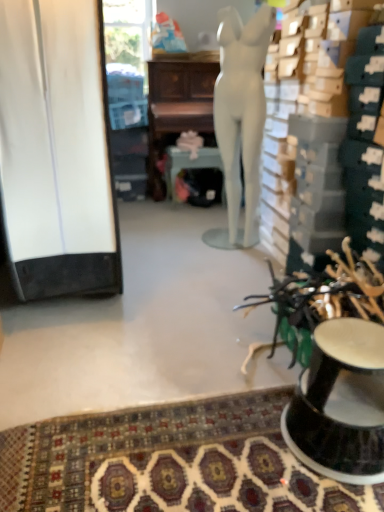
Find the location of a particular element. This screenshot has height=512, width=384. matte silver round table at center is located at coordinates (188, 164).

What do you see at coordinates (178, 105) in the screenshot? I see `wooden desk at center` at bounding box center [178, 105].

Where is `patterned carpet at lower center`? This screenshot has height=512, width=384. patterned carpet at lower center is located at coordinates (169, 462).

In order to click on white matte mannequin at center in this screenshot , I will do `click(241, 118)`.

This screenshot has height=512, width=384. I want to click on black glossy pedestal at lower right, so click(341, 403).

Considering the positions of point (250, 91) and point (169, 160), is point (250, 91) closer or farther from the camera than point (169, 160)?

Point (250, 91) is positioned closer to the camera compared to point (169, 160).

Is white matte mannequin at center shorter than matte silver round table at center?

No, white matte mannequin at center is not shorter than matte silver round table at center.

From the image's perspective, which is above, white matte mannequin at center or matte silver round table at center?

white matte mannequin at center.

Considering the relative sizes of white matte mannequin at center and matte silver round table at center in the image provided, is white matte mannequin at center thinner than matte silver round table at center?

Indeed, white matte mannequin at center has a lesser width compared to matte silver round table at center.

In the scene shown: Is matte silver round table at center to the right of patterned carpet at lower center from the viewer's perspective?

Yes, matte silver round table at center is to the right of patterned carpet at lower center.

From a real-world perspective, who is located higher, matte silver round table at center or patterned carpet at lower center?

From a 3D spatial view, matte silver round table at center is above.

Is matte silver round table at center positioned in front of patterned carpet at lower center?

No, matte silver round table at center is behind patterned carpet at lower center.

From the image's perspective, which one is positioned lower, matte silver round table at center or patterned carpet at lower center?

patterned carpet at lower center, from the image's perspective.

From the image's perspective, who appears lower, matte silver round table at center or wooden desk at center?

From the image's view, matte silver round table at center is below.

Does point (211, 147) lie behind point (148, 114)?

No, (211, 147) is closer to viewer.

Based on their sizes in the image, would you say matte silver round table at center is bigger or smaller than wooden desk at center?

Considering their sizes, matte silver round table at center takes up less space than wooden desk at center.

Which of these two, matte silver round table at center or wooden desk at center, stands shorter?

Standing shorter between the two is matte silver round table at center.

Locate an element on the screen. person above the wooden desk at center (from a real-world perspective) is located at coordinates (241, 118).

In the image, is white matte mannequin at center positioned in front of or behind wooden desk at center?

white matte mannequin at center is positioned closer to the viewer than wooden desk at center.

From a real-world perspective, which is physically above, white matte mannequin at center or wooden desk at center?

white matte mannequin at center.

Is white matte mannequin at center oriented towards wooden desk at center?

No, white matte mannequin at center does not turn towards wooden desk at center.

From the image's perspective, which is below, black glossy pedestal at lower right or patterned carpet at lower center?

patterned carpet at lower center appears lower in the image.

Which object is positioned more to the left, black glossy pedestal at lower right or patterned carpet at lower center?

patterned carpet at lower center is more to the left.

From the picture: Considering the relative sizes of black glossy pedestal at lower right and patterned carpet at lower center in the image provided, is black glossy pedestal at lower right bigger than patterned carpet at lower center?

Correct, black glossy pedestal at lower right is larger in size than patterned carpet at lower center.

I want to click on furniture that is above the patterned carpet at lower center (from a real-world perspective), so click(x=341, y=403).

Identify the location of person above the white matte cabinet at left (from the image's perspective). (241, 118).

In terms of size, does white matte cabinet at left appear bigger or smaller than white matte mannequin at center?

Considering their sizes, white matte cabinet at left takes up more space than white matte mannequin at center.

Between white matte cabinet at left and white matte mannequin at center, which one appears on the right side from the viewer's perspective?

white matte mannequin at center.

Is the position of white matte cabinet at left less distant than that of white matte mannequin at center?

Yes, the depth of white matte cabinet at left is less than that of white matte mannequin at center.

Does patterned carpet at lower center have a larger size compared to matte silver round table at center?

No.

Between patterned carpet at lower center and matte silver round table at center, which one has smaller width?

Thinner between the two is matte silver round table at center.

Is patterned carpet at lower center looking in the opposite direction of matte silver round table at center?

No, patterned carpet at lower center's orientation is not away from matte silver round table at center.

What's the angular difference between patterned carpet at lower center and matte silver round table at center's facing directions?

There is a 178-degree angle between the facing directions of patterned carpet at lower center and matte silver round table at center.

I want to click on person positioned vertically above the matte silver round table at center (from a real-world perspective), so click(x=241, y=118).

Locate an element on the screen. This screenshot has height=512, width=384. mat on the left of matte silver round table at center is located at coordinates (169, 462).

Considering their positions, is matte silver round table at center positioned closer to patterned carpet at lower center than white matte cabinet at left?

white matte cabinet at left is closer to patterned carpet at lower center.

Looking at the image, which one is located further to white matte mannequin at center, black glossy pedestal at lower right or wooden desk at center?

black glossy pedestal at lower right lies further to white matte mannequin at center than the other object.

In the scene shown: From the image, which object appears to be farther from black glossy pedestal at lower right, wooden desk at center or white matte cabinet at left?

Based on the image, wooden desk at center appears to be further to black glossy pedestal at lower right.

Which object lies further to the anchor point wooden desk at center, matte silver round table at center or black glossy pedestal at lower right?

The object further to wooden desk at center is black glossy pedestal at lower right.

Considering their positions, is wooden desk at center positioned further to white matte mannequin at center than patterned carpet at lower center?

Among the two, patterned carpet at lower center is located further to white matte mannequin at center.

Considering their positions, is patterned carpet at lower center positioned further to wooden desk at center than black glossy pedestal at lower right?

patterned carpet at lower center is further to wooden desk at center.

Looking at the image, which one is located closer to wooden desk at center, matte silver round table at center or white matte mannequin at center?

The object closer to wooden desk at center is matte silver round table at center.

Considering their positions, is wooden desk at center positioned further to white matte mannequin at center than black glossy pedestal at lower right?

black glossy pedestal at lower right is positioned further to the anchor white matte mannequin at center.

I want to click on cabinetry between black glossy pedestal at lower right and matte silver round table at center from front to back, so click(57, 150).

I want to click on person positioned between black glossy pedestal at lower right and wooden desk at center from near to far, so click(241, 118).

Where is `person between white matte cabinet at left and wooden desk at center along the z-axis`? The width and height of the screenshot is (384, 512). person between white matte cabinet at left and wooden desk at center along the z-axis is located at coordinates (241, 118).

What are the coordinates of `furniture between white matte cabinet at left and patterned carpet at lower center in the vertical direction` in the screenshot? It's located at (341, 403).